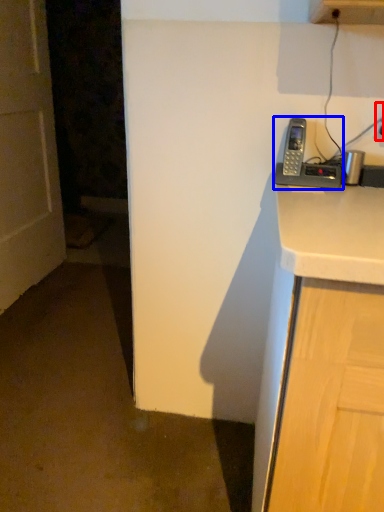
Question: Among these objects, which one is farthest to the camera, electric outlet (highlighted by a red box) or corded phone (highlighted by a blue box)?

Choices:
 (A) electric outlet
 (B) corded phone

Answer: (A)